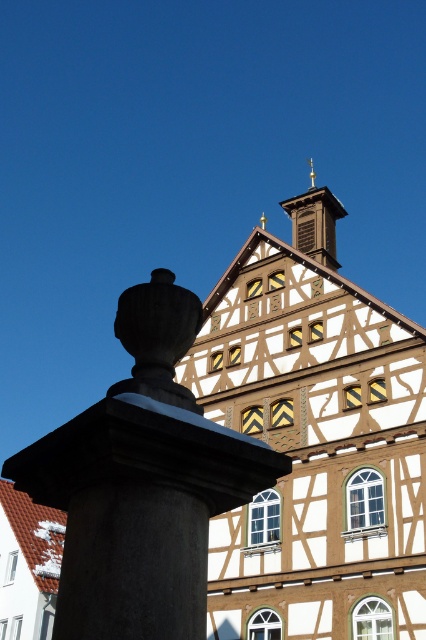
You are standing in front of a traditional half timbered building. You see two points marked on the building. The first point is at coordinate (36, 493) and the second point is at coordinate (331, 195). Which point is closer to you?

Point (36, 493) is closer to the camera than point (331, 195).

You are standing in front of the traditional half timbered building. You see the smooth stone column at left and the wooden bell tower at upper center. Which object is closer to the ground?

The smooth stone column at left is closer to the ground because it is below the wooden bell tower at upper center.

You are a visitor standing in front of the traditional half timbered building. You see the smooth stone column at left and the wooden bell tower at upper center. Which one appears taller in the image?

The smooth stone column at left is much taller than the wooden bell tower at upper center in the image.